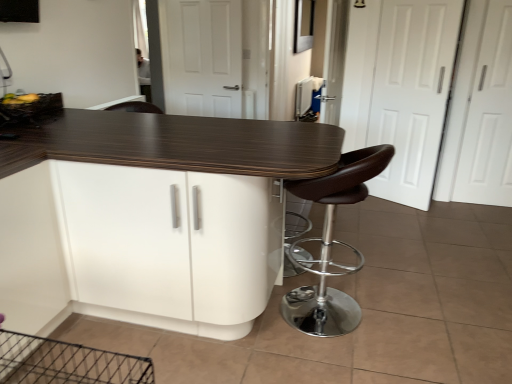
Locate an element on the screen. The height and width of the screenshot is (384, 512). free point above white glossy cabinet at center (from a real-world perspective) is located at coordinates (226, 137).